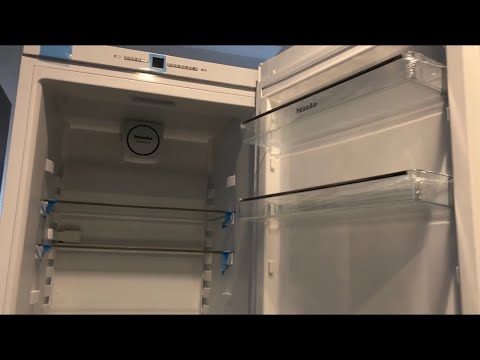
Locate an element on the screen. The width and height of the screenshot is (480, 360). door is located at coordinates (426, 262).